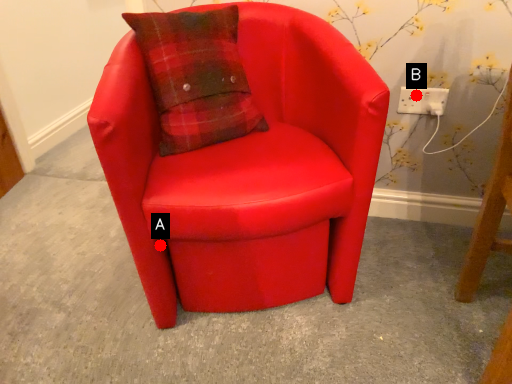
Question: Two points are circled on the image, labeled by A and B beside each circle. Among these points, which one is nearest to the camera?

Choices:
 (A) A is closer
 (B) B is closer

Answer: (A)